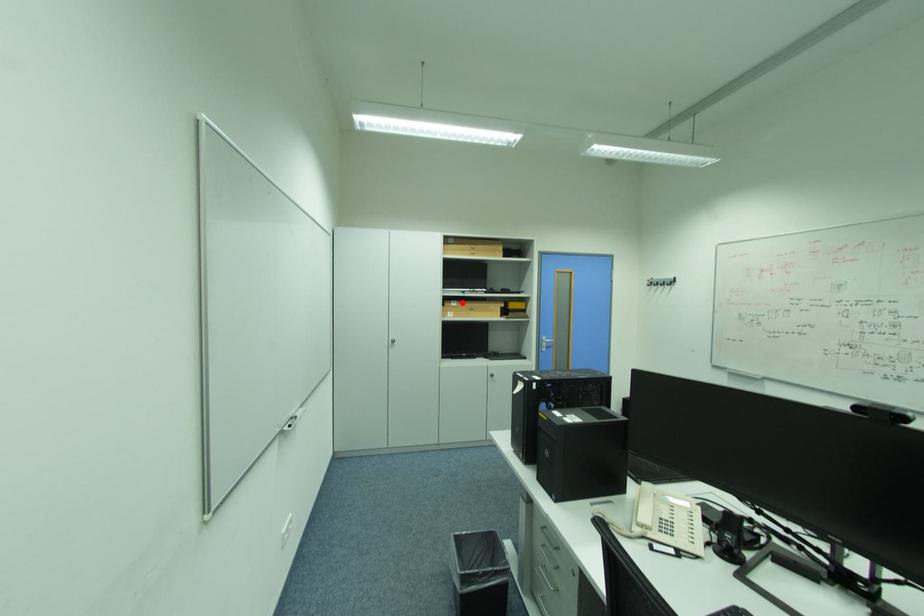
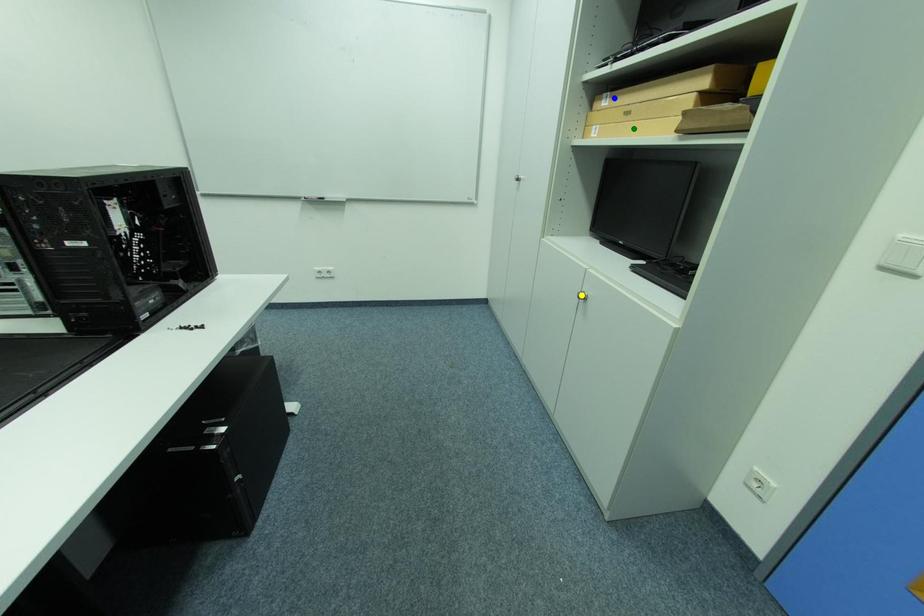
Question: I am providing you with two images of the same scene from different viewpoints. A red point is marked on the first image. You are given multiple points on the second image. Can you choose the point in image 2 that corresponds to the point in image 1?

Choices:
 (A) blue point
 (B) green point
 (C) yellow point

Answer: (A)